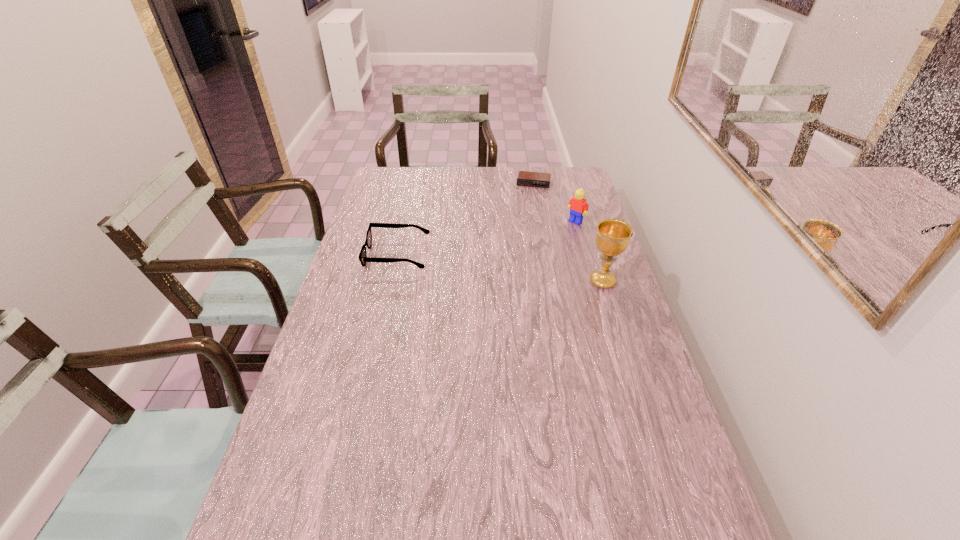
Where is `spectacles`? spectacles is located at coordinates (363, 258).

Where is `the second shortest object`? This screenshot has height=540, width=960. the second shortest object is located at coordinates [363, 258].

Where is `the tallest object`? The image size is (960, 540). the tallest object is located at coordinates (612, 238).

Locate an element on the screen. The width and height of the screenshot is (960, 540). Lego is located at coordinates (578, 207).

This screenshot has height=540, width=960. Identify the location of the third shortest object. (578, 207).

This screenshot has height=540, width=960. What are the coordinates of `alarm clock` in the screenshot? It's located at (525, 178).

This screenshot has height=540, width=960. Identify the location of the farthest object. (525, 178).

This screenshot has height=540, width=960. Find the location of `free space located 0.060m on the arms of the leftmost object`. free space located 0.060m on the arms of the leftmost object is located at coordinates (350, 255).

The image size is (960, 540). I want to click on vacant point located on the back of the chalice, so click(x=581, y=213).

I want to click on vacant space located 0.180m on the front-facing side of the second tallest object, so click(x=544, y=248).